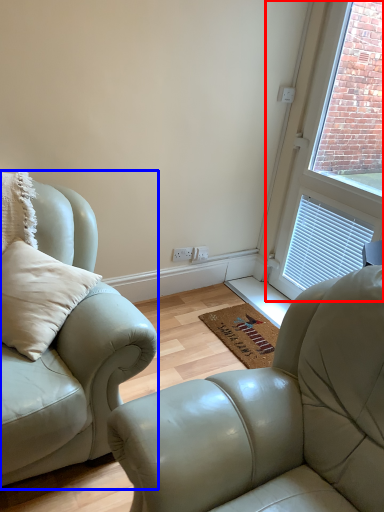
Question: Among these objects, which one is nearest to the camera, window (highlighted by a red box) or studio couch (highlighted by a blue box)?

Choices:
 (A) window
 (B) studio couch

Answer: (B)